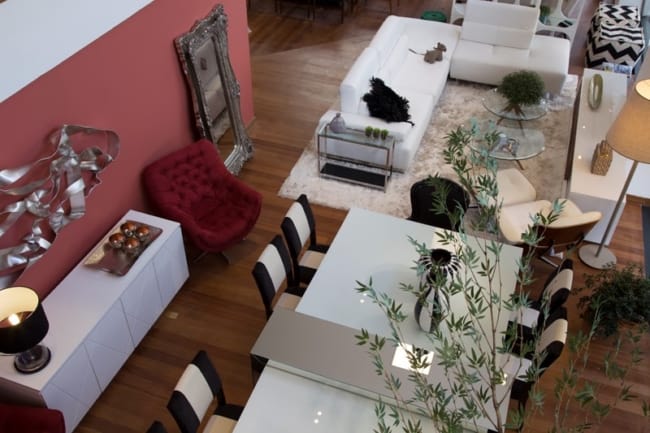
The image size is (650, 433). I want to click on fake tree, so click(x=494, y=383).